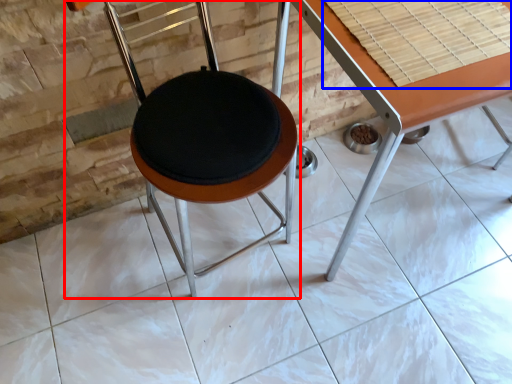
Question: Among these objects, which one is farthest to the camera, chair (highlighted by a red box) or table top (highlighted by a blue box)?

Choices:
 (A) chair
 (B) table top

Answer: (B)